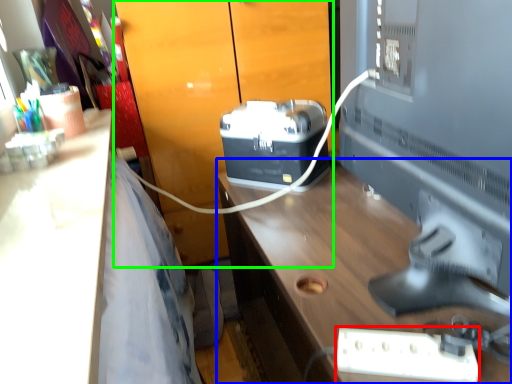
Question: Estimate the real-world distances between objects in this image. Which object is farther from extension cord (highlighted by a red box), desk (highlighted by a blue box) or dresser (highlighted by a green box)?

Choices:
 (A) desk
 (B) dresser

Answer: (B)